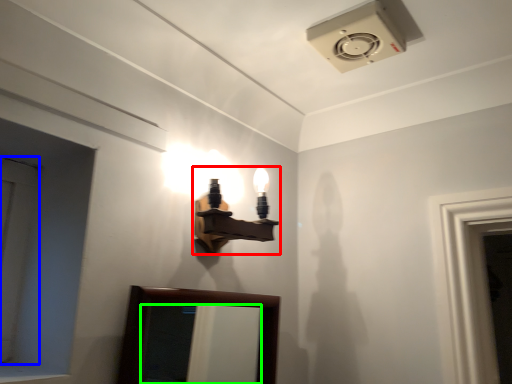
Question: Considering the real-world distances, which object is farthest from lamp (highlighted by a red box)? door (highlighted by a blue box) or mirror (highlighted by a green box)?

Choices:
 (A) door
 (B) mirror

Answer: (B)